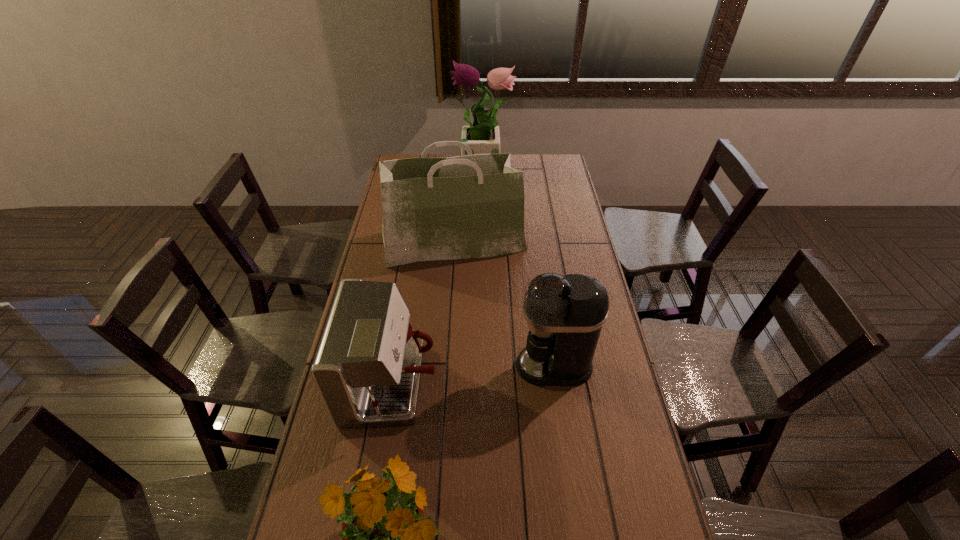
Locate an element on the screen. the farthest object is located at coordinates (483, 137).

Locate an element on the screen. The image size is (960, 540). flower arrangement is located at coordinates (483, 137).

I want to click on the fourth nearest object, so click(x=472, y=206).

Identify the location of the taller coffee maker. The image size is (960, 540). (565, 315).

This screenshot has width=960, height=540. Identify the location of the shorter coffee maker. (367, 369).

The width and height of the screenshot is (960, 540). Identify the location of vacant space located 0.190m on the front-facing side of the farthest object. (417, 170).

This screenshot has height=540, width=960. Find the location of `vacant area located on the front-facing side of the farthest object`. vacant area located on the front-facing side of the farthest object is located at coordinates (441, 170).

Find the location of `vacant space located 0.050m on the front-facing side of the farthest object`. vacant space located 0.050m on the front-facing side of the farthest object is located at coordinates pyautogui.click(x=444, y=170).

Where is `vacant region located on the back of the second farthest object`? The height and width of the screenshot is (540, 960). vacant region located on the back of the second farthest object is located at coordinates (456, 202).

The height and width of the screenshot is (540, 960). Find the location of `vacant space located place cup under the spout of the right coffee maker`. vacant space located place cup under the spout of the right coffee maker is located at coordinates (500, 366).